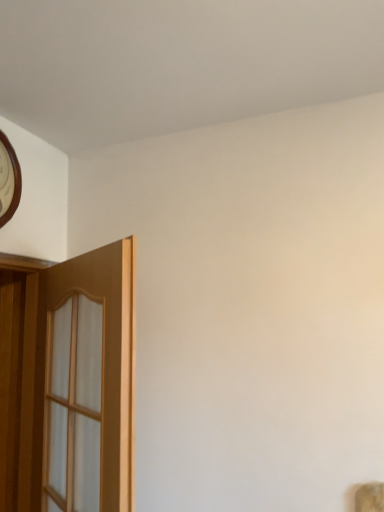
Question: Is wooden door at left bigger than wooden clock at upper left?

Choices:
 (A) no
 (B) yes

Answer: (B)

Question: Considering the relative sizes of wooden door at left and wooden clock at upper left in the image provided, is wooden door at left thinner than wooden clock at upper left?

Choices:
 (A) no
 (B) yes

Answer: (A)

Question: Would you say wooden door at left contains wooden clock at upper left?

Choices:
 (A) no
 (B) yes

Answer: (A)

Question: From a real-world perspective, is wooden door at left over wooden clock at upper left?

Choices:
 (A) no
 (B) yes

Answer: (A)

Question: Are wooden door at left and wooden clock at upper left located far from each other?

Choices:
 (A) no
 (B) yes

Answer: (A)

Question: Does wooden door at left have a lesser height compared to wooden clock at upper left?

Choices:
 (A) yes
 (B) no

Answer: (B)

Question: Is wooden clock at upper left oriented towards wooden door at left?

Choices:
 (A) yes
 (B) no

Answer: (B)

Question: Considering the relative sizes of wooden clock at upper left and wooden door at left in the image provided, is wooden clock at upper left shorter than wooden door at left?

Choices:
 (A) no
 (B) yes

Answer: (B)

Question: Does wooden clock at upper left have a larger size compared to wooden door at left?

Choices:
 (A) yes
 (B) no

Answer: (B)

Question: Is wooden clock at upper left next to wooden door at left and touching it?

Choices:
 (A) no
 (B) yes

Answer: (A)

Question: Does wooden clock at upper left have a smaller size compared to wooden door at left?

Choices:
 (A) no
 (B) yes

Answer: (B)

Question: Can you confirm if wooden clock at upper left is thinner than wooden door at left?

Choices:
 (A) no
 (B) yes

Answer: (B)

Question: Based on their sizes in the image, would you say wooden clock at upper left is bigger or smaller than wooden door at left?

Choices:
 (A) big
 (B) small

Answer: (B)